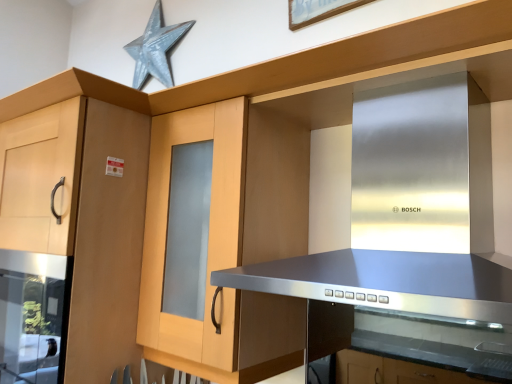
Question: From a real-world perspective, relative to metallic silver star at upper center, is light wood cabinet at left vertically above or below?

Choices:
 (A) above
 (B) below

Answer: (B)

Question: Is light wood cabinet at left in front of or behind metallic silver star at upper center in the image?

Choices:
 (A) behind
 (B) front

Answer: (B)

Question: Considering the real-world distances, which object is closest to the light wood cabinet at left?

Choices:
 (A) metallic silver star at upper center
 (B) stainless steel vent at center

Answer: (B)

Question: Which object is the closest to the stainless steel vent at center?

Choices:
 (A) light wood cabinet at left
 (B) metallic silver star at upper center

Answer: (A)